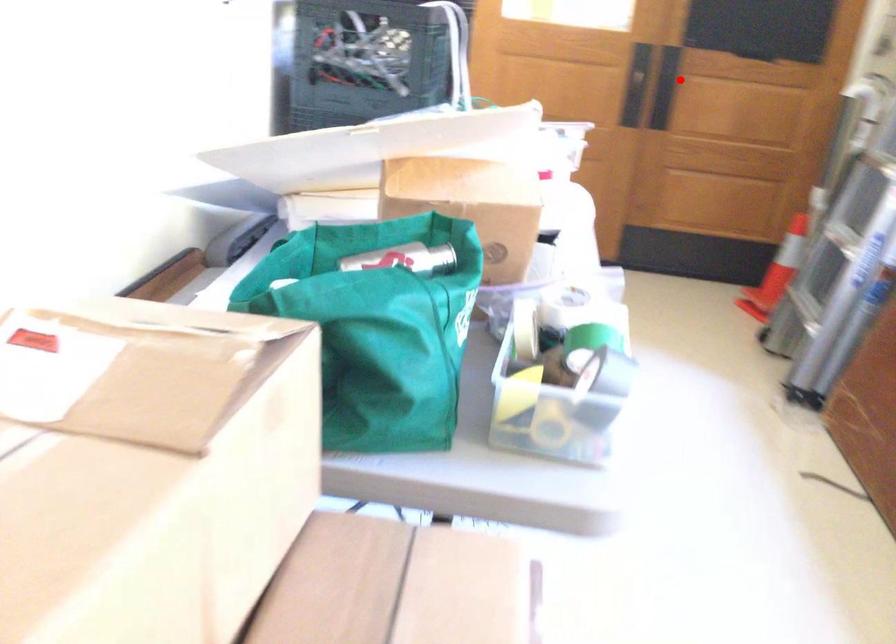
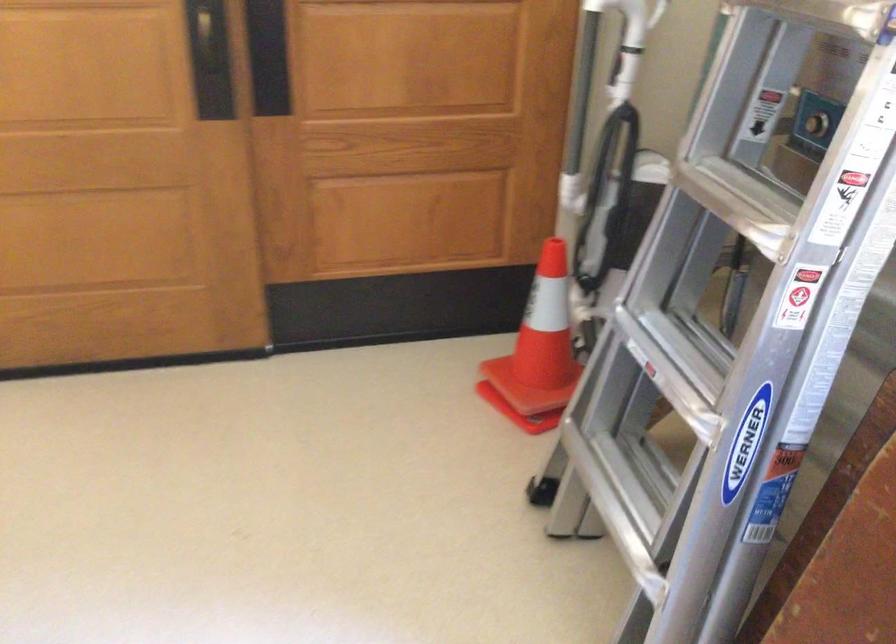
Question: I am providing you with two images of the same scene from different viewpoints. Given a red point in image1, look at the same physical point in image2. Is it:

Choices:
 (A) Closer to the viewpoint
 (B) Farther from the viewpoint

Answer: (A)